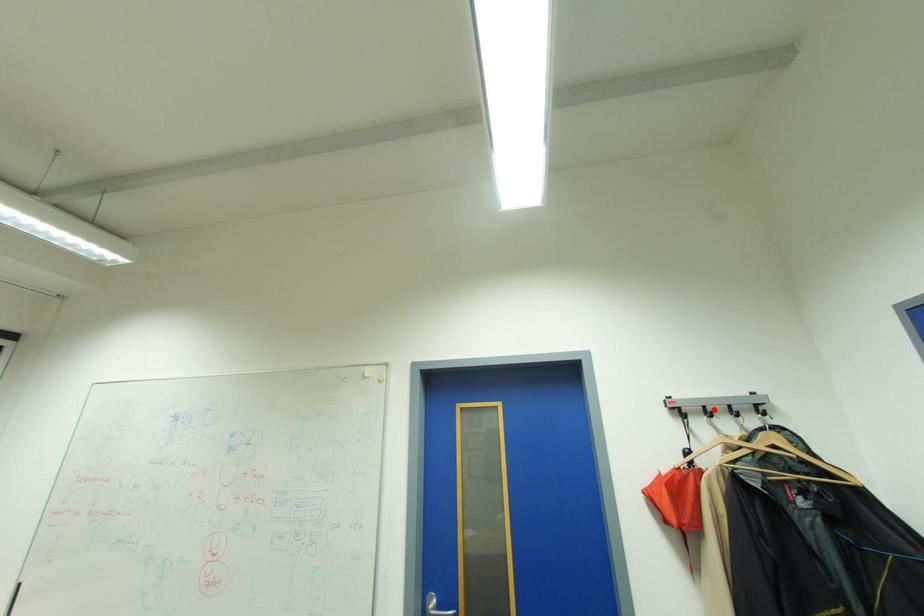
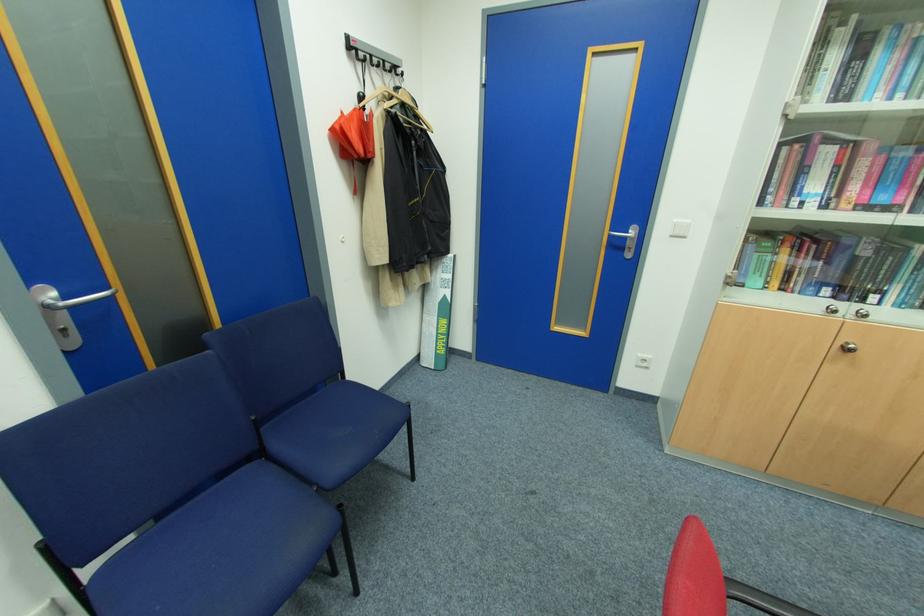
Question: I am providing you with two images of the same scene from different viewpoints. A red point is marked on the first image. At the location where the point appears in image 1, is it still visible in image 2?

Choices:
 (A) Yes
 (B) No

Answer: (A)